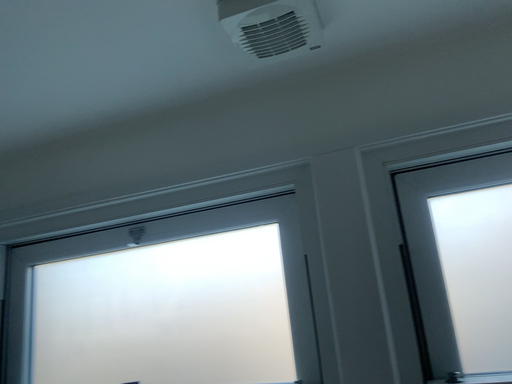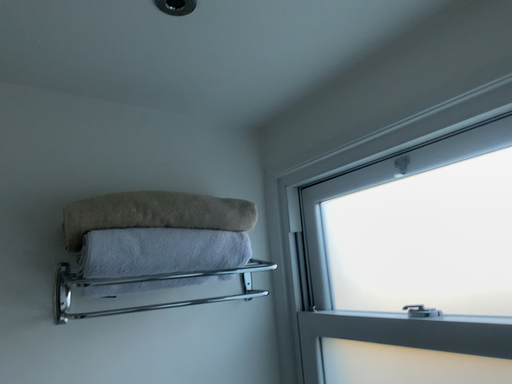
Question: How did the camera likely rotate when shooting the video?

Choices:
 (A) rotated downward
 (B) rotated upward

Answer: (A)